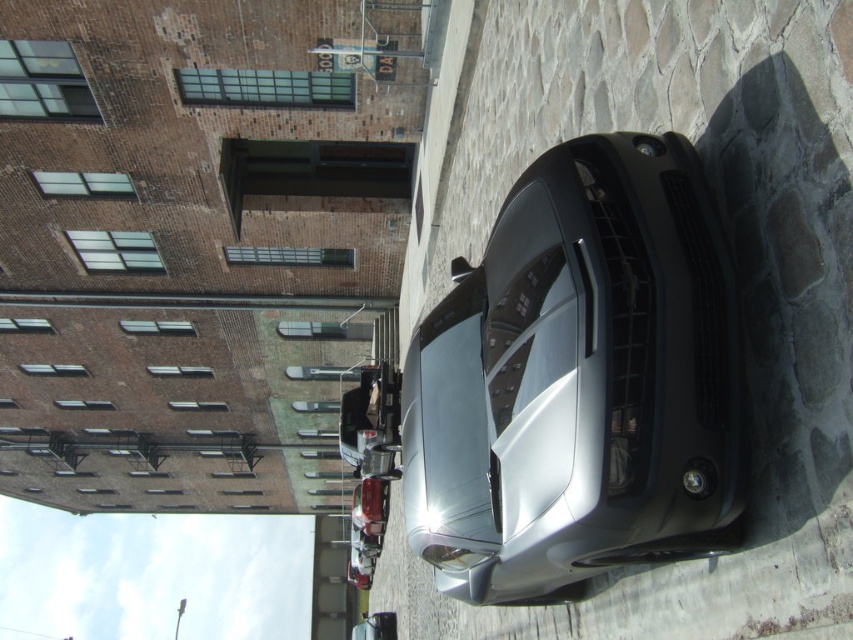
Question: Which point is closer to the camera taking this photo?

Choices:
 (A) (668, 310)
 (B) (358, 484)

Answer: (A)

Question: Considering the relative positions of satin silver car at center and shiny metallic car at center in the image provided, where is satin silver car at center located with respect to shiny metallic car at center?

Choices:
 (A) below
 (B) above

Answer: (B)

Question: Does satin silver car at center have a smaller size compared to shiny metallic car at center?

Choices:
 (A) yes
 (B) no

Answer: (A)

Question: Does satin silver car at center appear on the left side of shiny metallic car at center?

Choices:
 (A) no
 (B) yes

Answer: (A)

Question: Which of the following is the closest to the observer?

Choices:
 (A) (488, 355)
 (B) (376, 529)

Answer: (A)